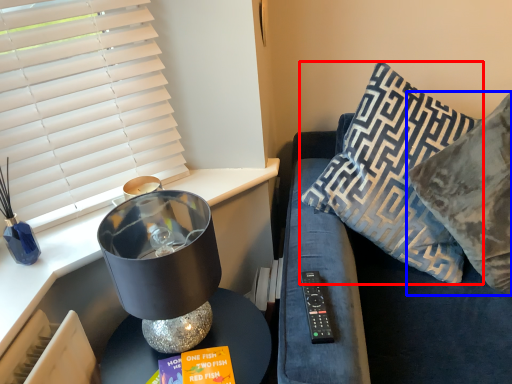
Question: Among these objects, which one is farthest to the camera, pillow (highlighted by a red box) or pillow (highlighted by a blue box)?

Choices:
 (A) pillow
 (B) pillow

Answer: (A)